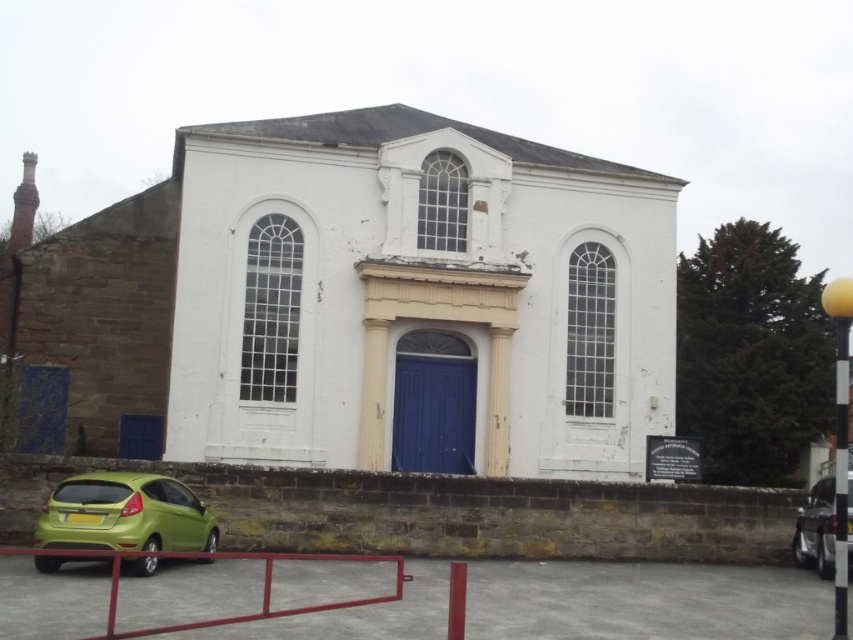
Question: Among these objects, which one is nearest to the camera?

Choices:
 (A) white painted wood chapel at center
 (B) green matte car at lower left
 (C) green matte hatchback at lower left
 (D) blue painted wood door at center

Answer: (B)

Question: Is metallic red barrier at lower left wider than green matte car at lower left?

Choices:
 (A) no
 (B) yes

Answer: (B)

Question: Is metallic red barrier at lower left to the left of blue painted wood door at center from the viewer's perspective?

Choices:
 (A) yes
 (B) no

Answer: (A)

Question: Which of the following is the closest to the observer?

Choices:
 (A) (194, 532)
 (B) (442, 397)

Answer: (A)

Question: Which object is closer to the camera taking this photo?

Choices:
 (A) blue painted wood door at center
 (B) white painted wood chapel at center

Answer: (B)

Question: Can you confirm if blue painted wood door at center is positioned above green matte car at lower left?

Choices:
 (A) no
 (B) yes

Answer: (B)